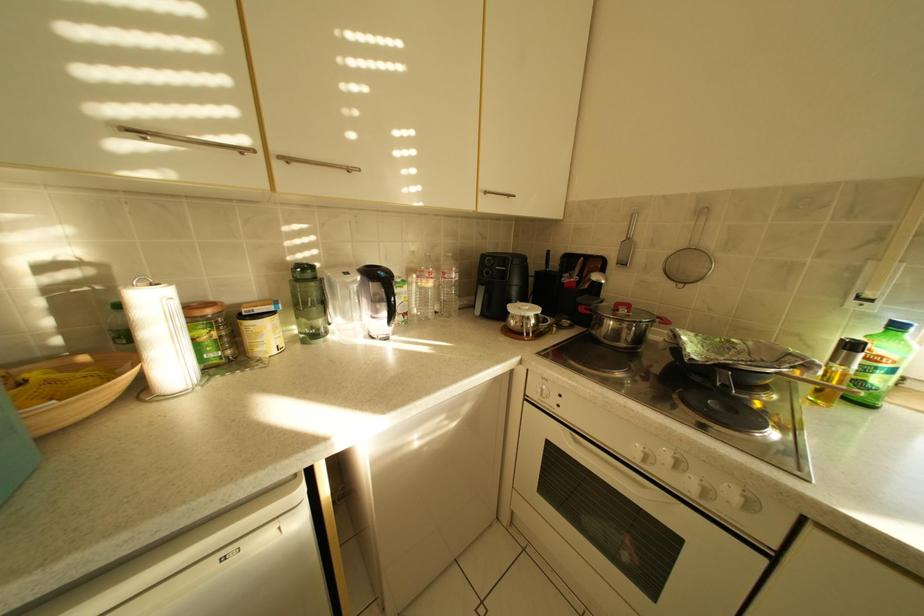
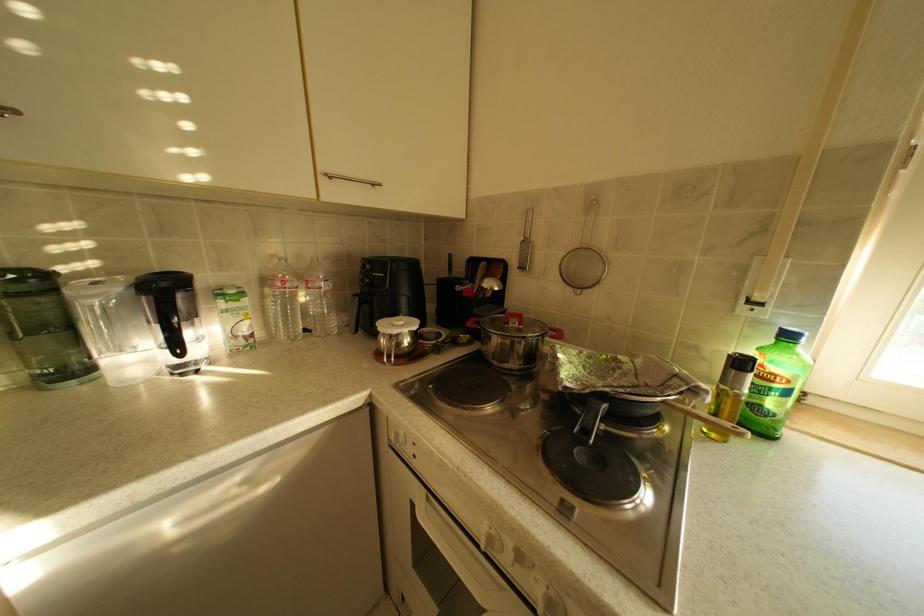
In a continuous first-person perspective shot, in which direction is the camera moving?

The movement direction of the cameraman is right, forward.